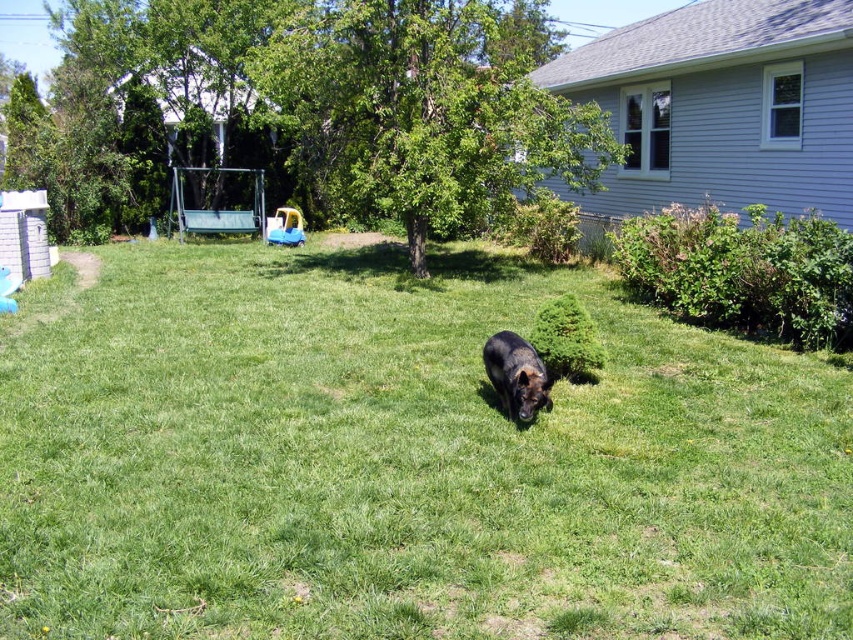
Who is positioned more to the right, green grassy at center or black fur dog at center?

black fur dog at center

Which is behind, point (70, 496) or point (531, 380)?

The point (531, 380) is more distant.

Which is in front, point (758, 372) or point (506, 358)?

Point (506, 358) is more forward.

This screenshot has height=640, width=853. Find the location of `green grassy at center`. green grassy at center is located at coordinates (403, 460).